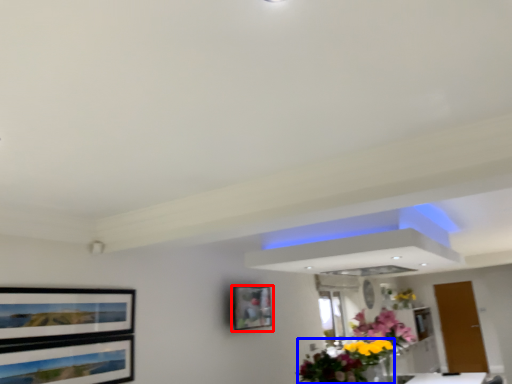
Question: Which object is closer to the camera taking this photo, picture frame (highlighted by a red box) or floral arrangement (highlighted by a blue box)?

Choices:
 (A) picture frame
 (B) floral arrangement

Answer: (B)